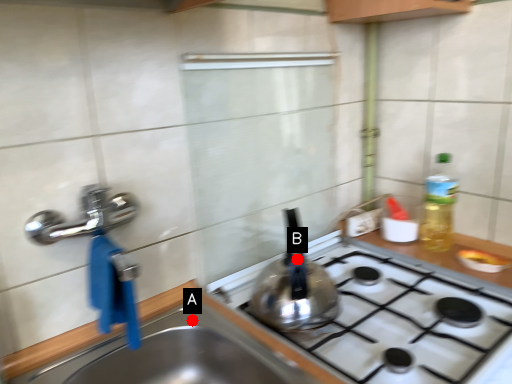
Question: Two points are circled on the image, labeled by A and B beside each circle. Which point is farther to the camera?

Choices:
 (A) A is further
 (B) B is further

Answer: (A)